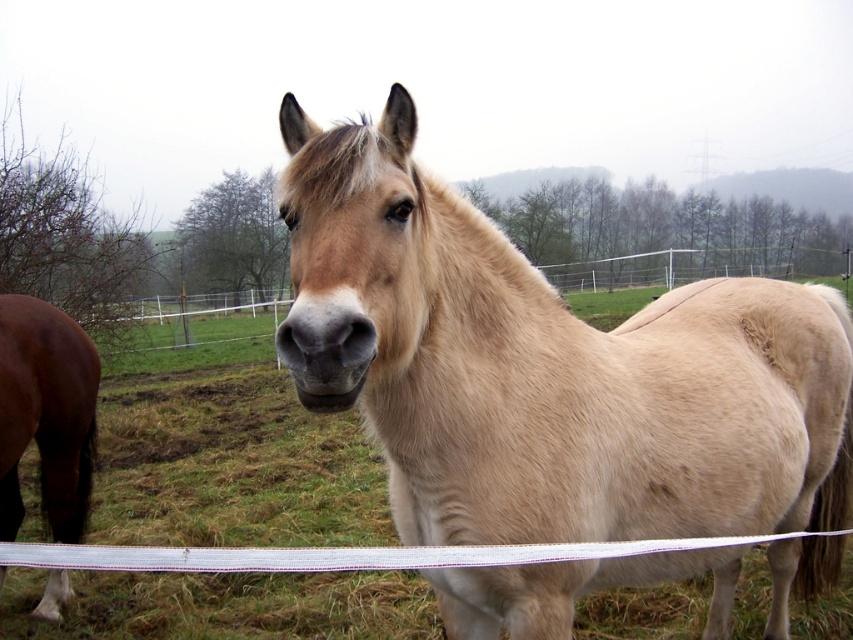
Based on the photo, between light brown horse at center and brown glossy horse at left, which one is positioned higher?

light brown horse at center is above.

Does light brown horse at center appear under brown glossy horse at left?

Incorrect, light brown horse at center is not positioned below brown glossy horse at left.

The width and height of the screenshot is (853, 640). In order to click on light brown horse at center in this screenshot , I will do `click(548, 369)`.